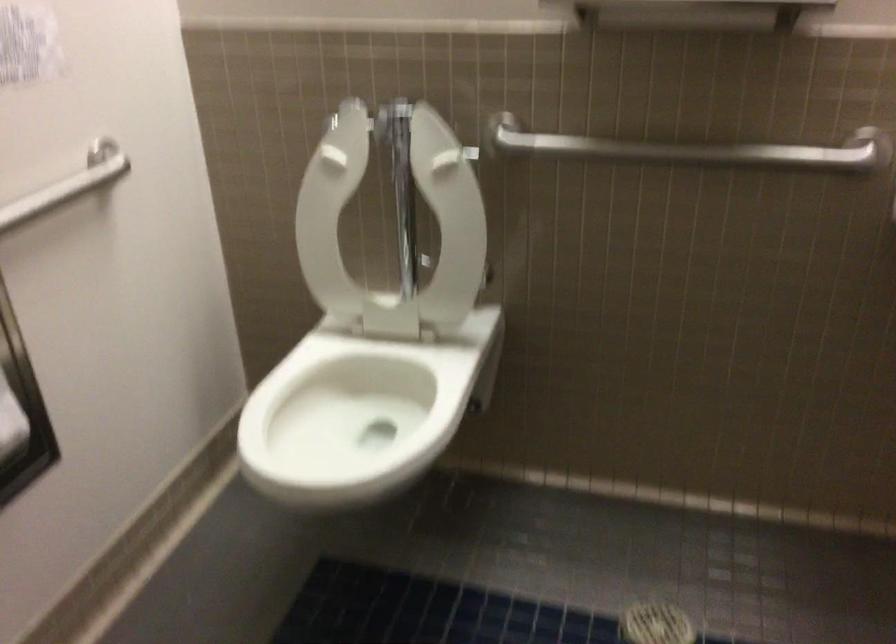
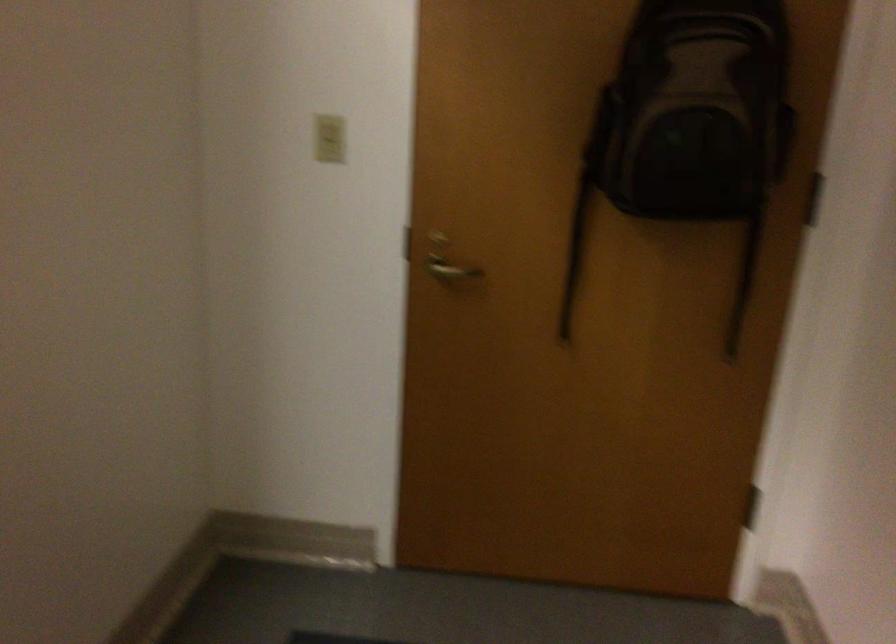
First-person continuous shooting, in which direction is the camera rotating?

The rotation direction of the camera is right-down.